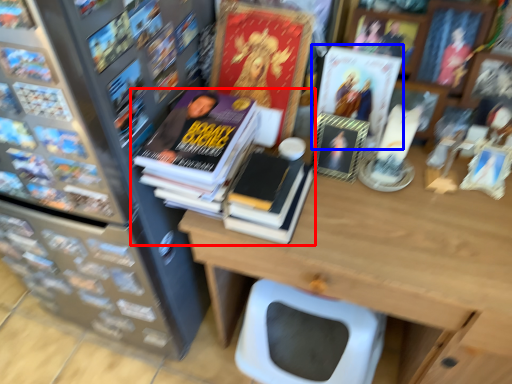
Question: Which object is further to the camera taking this photo, book (highlighted by a red box) or book cover (highlighted by a blue box)?

Choices:
 (A) book
 (B) book cover

Answer: (B)